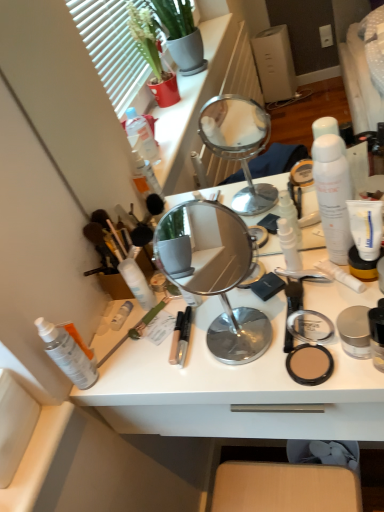
Locate an element on the screen. vacant space situated on the left part of white matte lotion at center, acting as the 2th toiletry starting from the right is located at coordinates (230, 314).